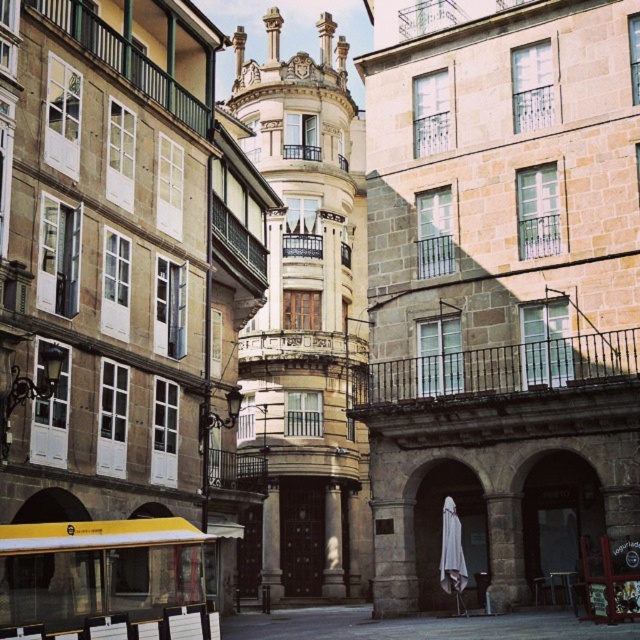
Between point (460, 556) and point (298, 54), which one is positioned in front?

Point (460, 556)

Is point (458, 588) behind point (301, 58)?

That is False.

At what (x,y) coordinates should I click in order to perform the action: click on white cotton robe at center. Please return your answer as a coordinate pair (x, y). Looking at the image, I should click on [x=451, y=550].